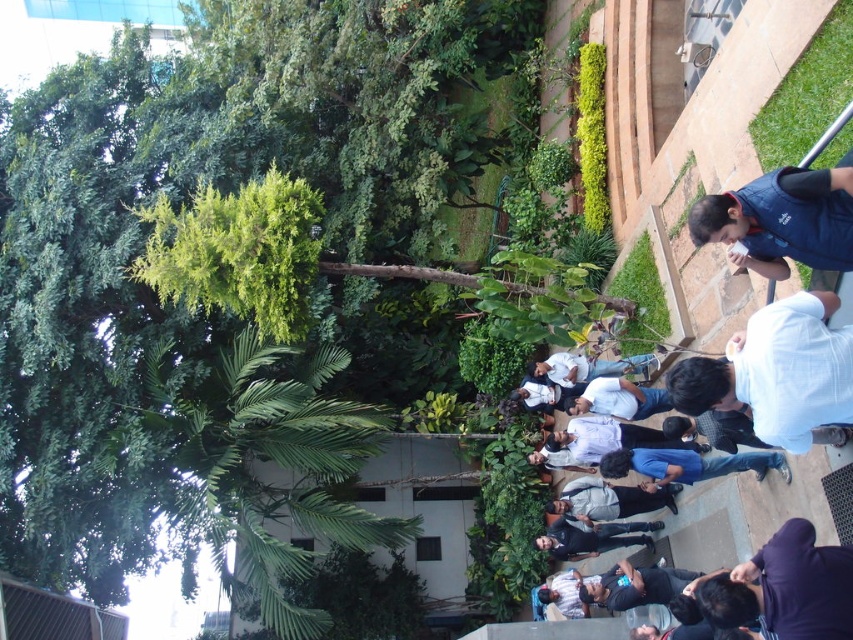
Question: Which point is closer to the camera?

Choices:
 (A) (614, 531)
 (B) (827, 216)
 (C) (792, 609)

Answer: (C)

Question: Can you confirm if white cotton shirt at lower right is smaller than blue denim jeans at lower center?

Choices:
 (A) yes
 (B) no

Answer: (A)

Question: Which of the following is the farthest from the observer?

Choices:
 (A) blue denim jeans at lower center
 (B) blue fleece vest at upper right

Answer: (A)

Question: Does blue fleece vest at upper right appear under blue denim jeans at lower center?

Choices:
 (A) yes
 (B) no

Answer: (B)

Question: Does blue fleece vest at upper right appear on the left side of blue denim jeans at lower center?

Choices:
 (A) no
 (B) yes

Answer: (B)

Question: Which of these objects is positioned closest to the blue fleece vest at upper right?

Choices:
 (A) dark blue shirt at lower right
 (B) dark blue shirt at center

Answer: (A)